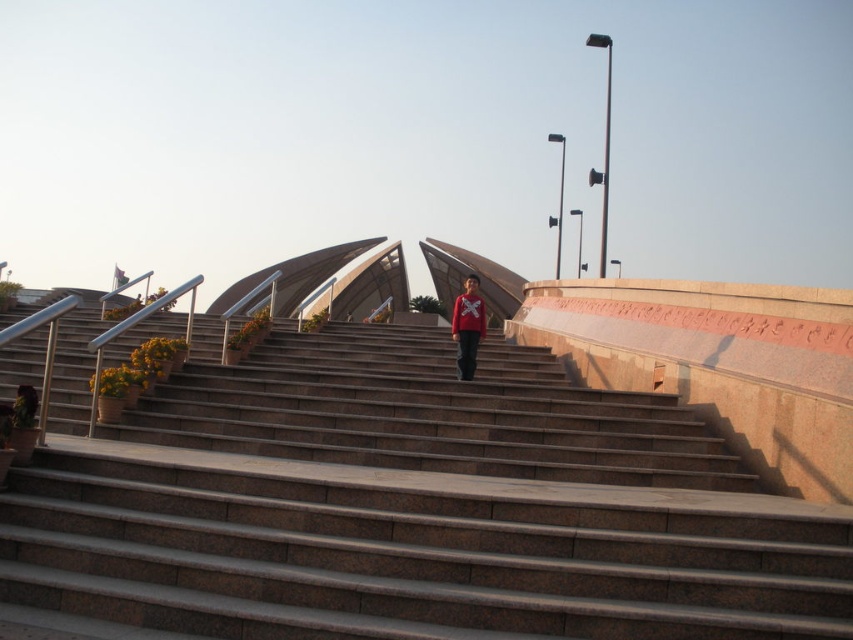
Does brown stone stairs at center have a larger size compared to matte red sweater at center?

Correct, brown stone stairs at center is larger in size than matte red sweater at center.

Is brown stone stairs at center further to camera compared to matte red sweater at center?

That is False.

Find the location of `brown stone stairs at center`. brown stone stairs at center is located at coordinates pyautogui.click(x=403, y=506).

Locate an element on the screen. brown stone stairs at center is located at coordinates [403, 506].